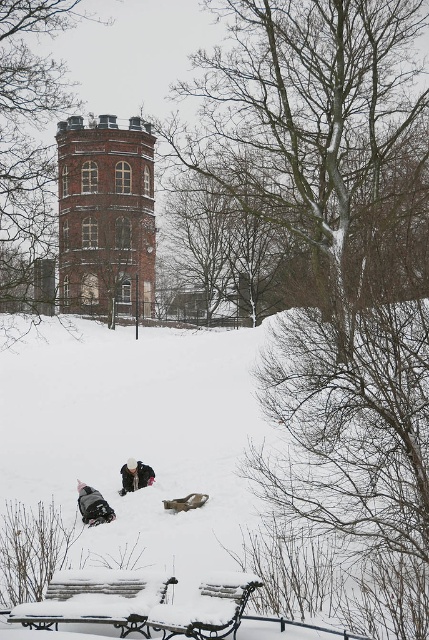
Question: Which of the following is the farthest from the observer?

Choices:
 (A) (235, 440)
 (B) (62, 584)

Answer: (A)

Question: Which of the following is the closest to the observer?

Choices:
 (A) (190, 621)
 (B) (192, 396)
 (C) (102, 516)

Answer: (A)

Question: Can you confirm if white fluffy snow at lower center is wider than snow-covered wood bench at lower left?

Choices:
 (A) yes
 (B) no

Answer: (A)

Question: Is brick tower at center above dark gray snowsuit at lower left?

Choices:
 (A) yes
 (B) no

Answer: (A)

Question: Which point is closer to the camera taking this photo?

Choices:
 (A) (102, 122)
 (B) (193, 625)

Answer: (B)

Question: Is white fluffy snow at lower center wider than white snowsuit at lower center?

Choices:
 (A) no
 (B) yes

Answer: (B)